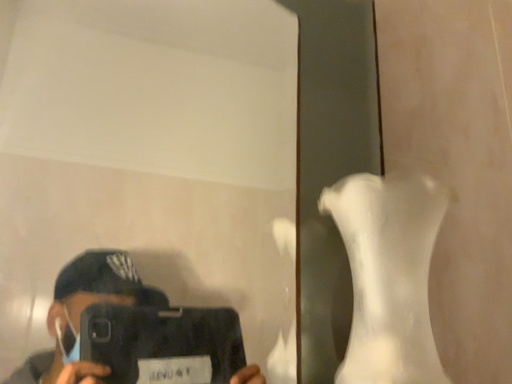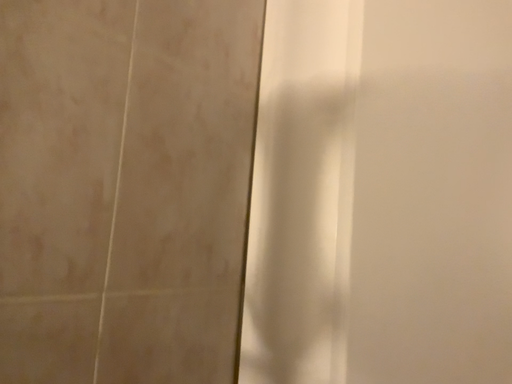
Question: How did the camera likely rotate when shooting the video?

Choices:
 (A) rotated upward
 (B) rotated downward

Answer: (B)